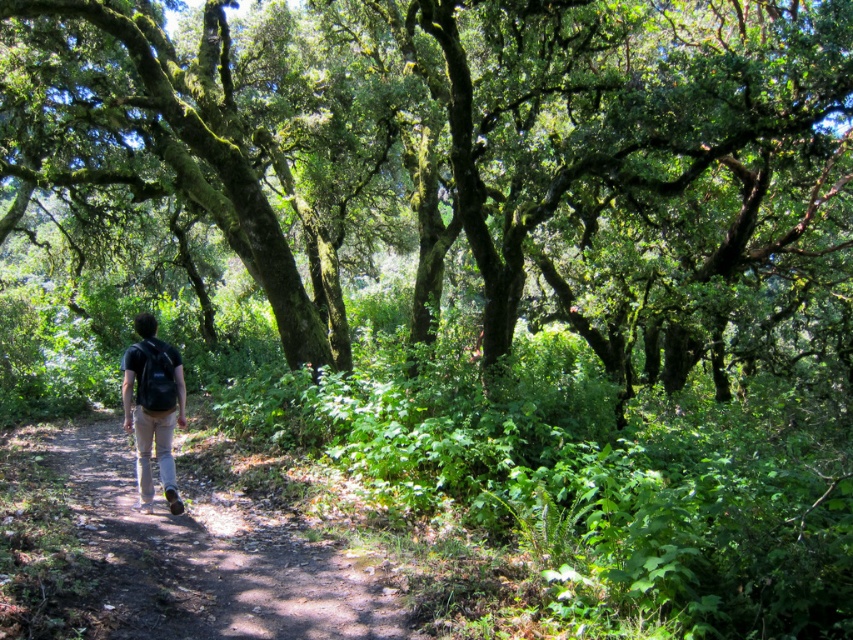
Question: Is brown dirt path at center above matte black backpack at center?

Choices:
 (A) no
 (B) yes

Answer: (A)

Question: Can you confirm if green mossy tree at center is positioned to the right of matte black backpack at center?

Choices:
 (A) yes
 (B) no

Answer: (B)

Question: Among these objects, which one is farthest from the camera?

Choices:
 (A) green mossy tree at center
 (B) matte black backpack at center

Answer: (A)

Question: Which point is farther to the camera?

Choices:
 (A) (143, 444)
 (B) (96, 435)
 (C) (323, 112)

Answer: (C)

Question: Which point appears farthest from the camera in this image?

Choices:
 (A) (140, 497)
 (B) (448, 145)
 (C) (231, 509)

Answer: (B)

Question: Can you confirm if green mossy tree at center is positioned above matte black backpack at center?

Choices:
 (A) yes
 (B) no

Answer: (A)